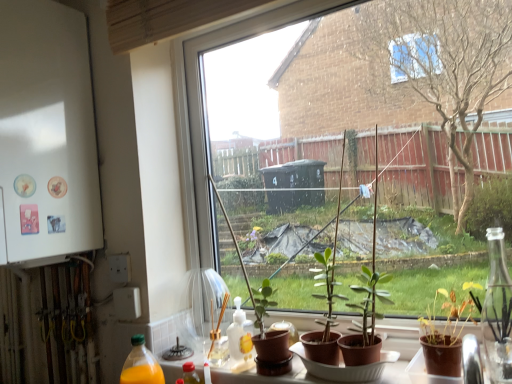
How much space does green matte plant at center, placed as the second houseplant when sorted from front to back, occupy vertically?

The height of green matte plant at center, placed as the second houseplant when sorted from front to back, is 8.66 inches.

Find the location of `white matte refrigerator at left`. white matte refrigerator at left is located at coordinates (46, 134).

Is green matte plant at center, which ranks as the first houseplant in left-to-right order, completely or partially inside brown matte pot at lower right, the 2th houseplant positioned from the back?

No, brown matte pot at lower right, the 2th houseplant positioned from the back, does not contain green matte plant at center, which ranks as the first houseplant in left-to-right order.

How much distance is there between brown matte pot at lower right, placed as the first houseplant when sorted from front to back, and green matte plant at center, marked as the second houseplant in a right-to-left arrangement?

A distance of 14.84 inches exists between brown matte pot at lower right, placed as the first houseplant when sorted from front to back, and green matte plant at center, marked as the second houseplant in a right-to-left arrangement.

From the image's perspective, is brown matte pot at lower right, the 2th houseplant positioned from the back, on top of green matte plant at center, marked as the second houseplant in a right-to-left arrangement?

Yes, from the image's perspective, brown matte pot at lower right, the 2th houseplant positioned from the back, is over green matte plant at center, marked as the second houseplant in a right-to-left arrangement.

Can you tell me how much brown matte pot at lower right, placed as the first houseplant when sorted from front to back, and green matte plant at center, placed as the second houseplant when sorted from front to back, differ in facing direction?

There is a 0.325-degree angle between the facing directions of brown matte pot at lower right, placed as the first houseplant when sorted from front to back, and green matte plant at center, placed as the second houseplant when sorted from front to back.

Is transparent glass window at center behind brown matte pot at lower right, which is counted as the 1th houseplant, starting from the right?

Yes, transparent glass window at center is behind brown matte pot at lower right, which is counted as the 1th houseplant, starting from the right.

Which is correct: transparent glass window at center is inside brown matte pot at lower right, placed as the first houseplant when sorted from front to back, or outside of it?

transparent glass window at center is not enclosed by brown matte pot at lower right, placed as the first houseplant when sorted from front to back.

Considering the sizes of objects transparent glass window at center and brown matte pot at lower right, which is counted as the 1th houseplant, starting from the right, in the image provided, who is bigger, transparent glass window at center or brown matte pot at lower right, which is counted as the 1th houseplant, starting from the right,?

transparent glass window at center.

Locate an element on the screen. window that appears above the brown matte pot at lower right, which is counted as the 1th houseplant, starting from the right (from a real-world perspective) is located at coordinates (350, 114).

Considering the sizes of objects brown matte pot at lower right, the 2th houseplant positioned from the back, and transparent glass window at center in the image provided, who is smaller, brown matte pot at lower right, the 2th houseplant positioned from the back, or transparent glass window at center?

Smaller between the two is brown matte pot at lower right, the 2th houseplant positioned from the back.

Considering the positions of objects brown matte pot at lower right, placed as the first houseplant when sorted from front to back, and transparent glass window at center in the image provided, who is in front, brown matte pot at lower right, placed as the first houseplant when sorted from front to back, or transparent glass window at center?

brown matte pot at lower right, placed as the first houseplant when sorted from front to back, is closer to the camera.

Considering the relative positions of brown matte pot at lower right, the 2th houseplant positioned from the left, and transparent glass window at center in the image provided, is brown matte pot at lower right, the 2th houseplant positioned from the left, to the left or to the right of transparent glass window at center?

Based on their positions, brown matte pot at lower right, the 2th houseplant positioned from the left, is located to the right of transparent glass window at center.

In the scene shown: Considering the sizes of brown matte pot at lower right, the 2th houseplant positioned from the left, and transparent glass window at center in the image, is brown matte pot at lower right, the 2th houseplant positioned from the left, wider or thinner than transparent glass window at center?

Clearly, brown matte pot at lower right, the 2th houseplant positioned from the left, has more width compared to transparent glass window at center.

How different are the orientations of brown matte pot at lower right, the 2th houseplant positioned from the left, and white matte refrigerator at left in degrees?

brown matte pot at lower right, the 2th houseplant positioned from the left, and white matte refrigerator at left are facing 2.62 degrees away from each other.

Considering the sizes of objects brown matte pot at lower right, placed as the first houseplant when sorted from front to back, and white matte refrigerator at left in the image provided, who is bigger, brown matte pot at lower right, placed as the first houseplant when sorted from front to back, or white matte refrigerator at left?

Bigger between the two is white matte refrigerator at left.

From the image's perspective, is brown matte pot at lower right, which is counted as the 1th houseplant, starting from the right, positioned above or below white matte refrigerator at left?

brown matte pot at lower right, which is counted as the 1th houseplant, starting from the right, is situated lower than white matte refrigerator at left in the image.

Is brown matte pot at lower right, placed as the first houseplant when sorted from front to back, turned away from white matte refrigerator at left?

No.

Is green matte plant at center, marked as the second houseplant in a right-to-left arrangement, next to white matte refrigerator at left?

green matte plant at center, marked as the second houseplant in a right-to-left arrangement, is not next to white matte refrigerator at left, and they're not touching.

Is green matte plant at center, placed as the second houseplant when sorted from front to back, taller or shorter than white matte refrigerator at left?

In the image, green matte plant at center, placed as the second houseplant when sorted from front to back, appears to be shorter than white matte refrigerator at left.

Which object is closer to the camera taking this photo, green matte plant at center, which ranks as the first houseplant in left-to-right order, or white matte refrigerator at left?

green matte plant at center, which ranks as the first houseplant in left-to-right order, is closer to the camera.

Is white matte refrigerator at left located within green matte plant at center, which ranks as the first houseplant in left-to-right order?

No, white matte refrigerator at left is not inside green matte plant at center, which ranks as the first houseplant in left-to-right order.

In the scene shown: Considering the sizes of white matte refrigerator at left and transparent glass window at center in the image, is white matte refrigerator at left wider or thinner than transparent glass window at center?

Clearly, white matte refrigerator at left has more width compared to transparent glass window at center.

Measure the distance between white matte refrigerator at left and transparent glass window at center.

The distance of white matte refrigerator at left from transparent glass window at center is 70.94 centimeters.

Is point (34, 181) more distant than point (316, 304)?

No, it is not.

Which object is closer to the camera taking this photo, white matte refrigerator at left or transparent glass window at center?

transparent glass window at center is in front.

Which of these two, green matte plant at center, placed as the second houseplant when sorted from front to back, or transparent glass window at center, stands shorter?

green matte plant at center, placed as the second houseplant when sorted from front to back.

In the scene shown: Which object is wider, green matte plant at center, placed as the second houseplant when sorted from front to back, or transparent glass window at center?

With larger width is green matte plant at center, placed as the second houseplant when sorted from front to back.

What's the angular difference between green matte plant at center, which ranks as the first houseplant in left-to-right order, and transparent glass window at center's facing directions?

The facing directions of green matte plant at center, which ranks as the first houseplant in left-to-right order, and transparent glass window at center are 0.89 degrees apart.

Is green matte plant at center, which ranks as the first houseplant in left-to-right order, placed right next to transparent glass window at center?

No, green matte plant at center, which ranks as the first houseplant in left-to-right order, is not with transparent glass window at center.

Where is `houseplant below the brown matte pot at lower right, the 2th houseplant positioned from the left (from the image's perspective)`? This screenshot has height=384, width=512. houseplant below the brown matte pot at lower right, the 2th houseplant positioned from the left (from the image's perspective) is located at coordinates (269, 336).

You are a GUI agent. You are given a task and a screenshot of the screen. Output one action in this format:
    pyautogui.click(x=<x>, y=<y>)
    Task: Click on the window above the brown matte pot at lower right, the 2th houseplant positioned from the left (from the image's perspective)
    
    Given the screenshot: What is the action you would take?
    pyautogui.click(x=350, y=114)

Which object lies further to the anchor point brown matte pot at lower right, which is counted as the 1th houseplant, starting from the right, white matte refrigerator at left or green matte plant at center, which ranks as the first houseplant in left-to-right order?

white matte refrigerator at left lies further to brown matte pot at lower right, which is counted as the 1th houseplant, starting from the right, than the other object.

Estimate the real-world distances between objects in this image. Which object is further from white matte refrigerator at left, green matte plant at center, marked as the second houseplant in a right-to-left arrangement, or transparent glass window at center?

green matte plant at center, marked as the second houseplant in a right-to-left arrangement, is further to white matte refrigerator at left.

Based on their spatial positions, is transparent glass window at center or green matte plant at center, placed as the second houseplant when sorted from front to back, closer to white matte refrigerator at left?

transparent glass window at center.

From the image, which object appears to be farther from brown matte pot at lower right, which is counted as the 1th houseplant, starting from the right, green matte plant at center, which ranks as the first houseplant in left-to-right order, or white matte refrigerator at left?

Among the two, white matte refrigerator at left is located further to brown matte pot at lower right, which is counted as the 1th houseplant, starting from the right.

When comparing their distances from green matte plant at center, marked as the second houseplant in a right-to-left arrangement, does white matte refrigerator at left or brown matte pot at lower right, the 2th houseplant positioned from the back, seem further?

The object further to green matte plant at center, marked as the second houseplant in a right-to-left arrangement, is white matte refrigerator at left.

In the scene shown: When comparing their distances from green matte plant at center, the first houseplant viewed from the back, does brown matte pot at lower right, placed as the first houseplant when sorted from front to back, or white matte refrigerator at left seem closer?

Based on the image, brown matte pot at lower right, placed as the first houseplant when sorted from front to back, appears to be nearer to green matte plant at center, the first houseplant viewed from the back.

Which object lies further to the anchor point transparent glass window at center, brown matte pot at lower right, placed as the first houseplant when sorted from front to back, or white matte refrigerator at left?

brown matte pot at lower right, placed as the first houseplant when sorted from front to back, is further to transparent glass window at center.

When comparing their distances from white matte refrigerator at left, does brown matte pot at lower right, the 2th houseplant positioned from the left, or green matte plant at center, marked as the second houseplant in a right-to-left arrangement, seem further?

brown matte pot at lower right, the 2th houseplant positioned from the left, lies further to white matte refrigerator at left than the other object.

The height and width of the screenshot is (384, 512). What are the coordinates of `window between brown matte pot at lower right, the 2th houseplant positioned from the back, and green matte plant at center, marked as the second houseplant in a right-to-left arrangement, from front to back` in the screenshot? It's located at (350, 114).

The height and width of the screenshot is (384, 512). Identify the location of window between white matte refrigerator at left and brown matte pot at lower right, placed as the first houseplant when sorted from front to back, from left to right. (350, 114).

Image resolution: width=512 pixels, height=384 pixels. I want to click on houseplant between white matte refrigerator at left and brown matte pot at lower right, placed as the first houseplant when sorted from front to back, in the horizontal direction, so click(x=269, y=336).

The height and width of the screenshot is (384, 512). In order to click on houseplant between white matte refrigerator at left and transparent glass window at center in this screenshot , I will do `click(269, 336)`.